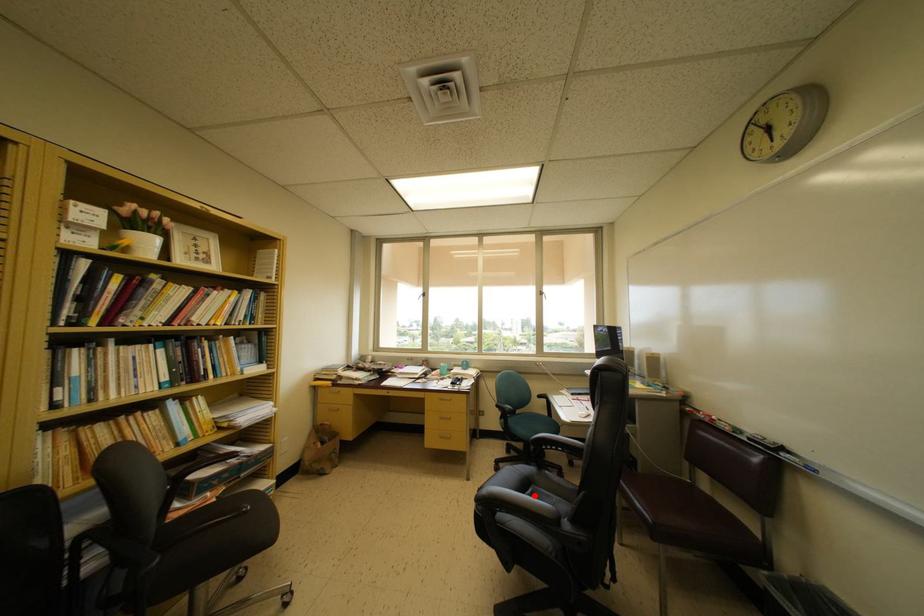
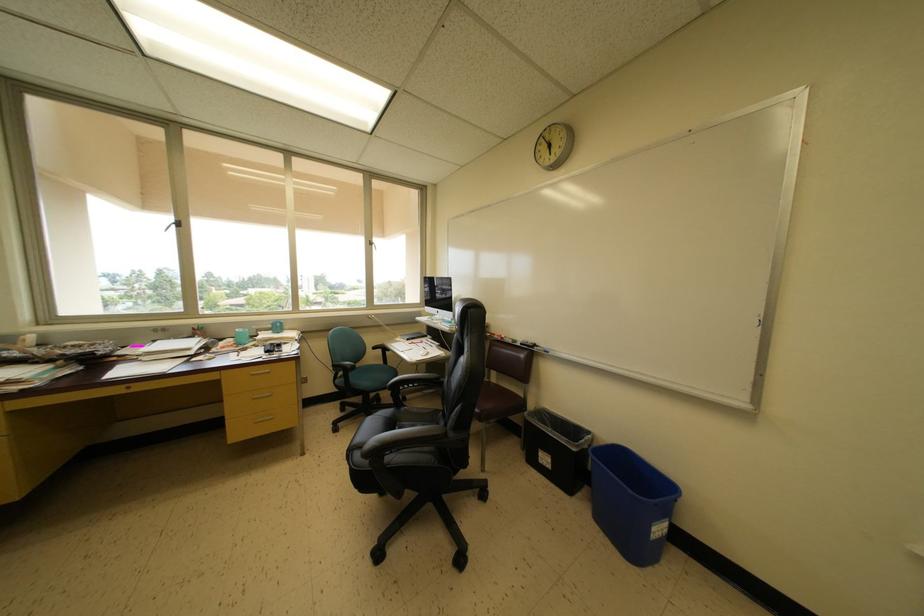
Question: I am providing you with two images of the same scene from different viewpoints. Given a red point in image1, look at the same physical point in image2. Is it:

Choices:
 (A) Closer to the viewpoint
 (B) Farther from the viewpoint

Answer: (B)